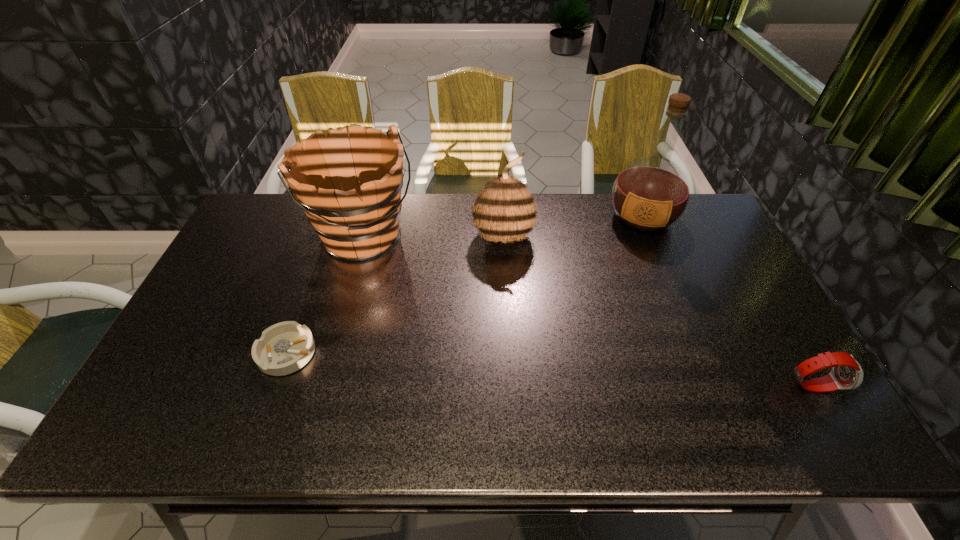
At what (x,y) coordinates should I click in order to perform the action: click on ashtray located at the near edge. Please return your answer as a coordinate pair (x, y). Looking at the image, I should click on (285, 347).

What are the coordinates of `watch that is at the near edge` in the screenshot? It's located at (846, 373).

At what (x,y) coordinates should I click in order to perform the action: click on watch that is positioned at the right edge. Please return your answer as a coordinate pair (x, y). Looking at the image, I should click on (846, 373).

Where is `liquor at the right edge`? The image size is (960, 540). liquor at the right edge is located at coordinates (650, 194).

The image size is (960, 540). Find the location of `object present at the far right corner`. object present at the far right corner is located at coordinates (650, 194).

This screenshot has width=960, height=540. What are the coordinates of `object at the near right corner` in the screenshot? It's located at (846, 373).

Where is `free space at the far edge`? free space at the far edge is located at coordinates (436, 208).

Locate an element on the screen. The height and width of the screenshot is (540, 960). vacant space at the near edge is located at coordinates (407, 399).

In the image, there is a desktop. Where is `vacant space at the right edge`? The image size is (960, 540). vacant space at the right edge is located at coordinates (684, 243).

The height and width of the screenshot is (540, 960). Find the location of `vacant space at the far left corner of the desktop`. vacant space at the far left corner of the desktop is located at coordinates (267, 206).